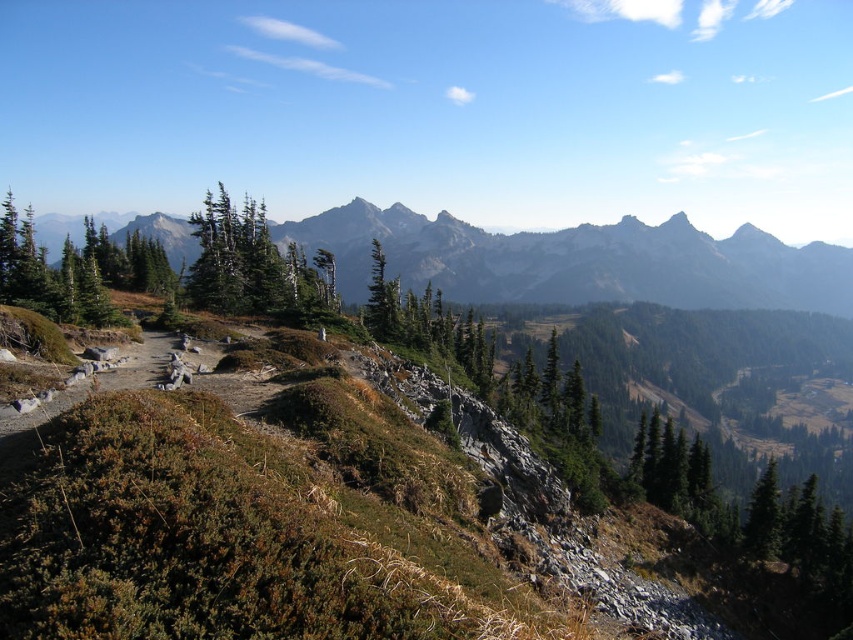
Question: Where is gray rocky mountains at center located in relation to green matte tree at center in the image?

Choices:
 (A) left
 (B) right

Answer: (B)

Question: Considering the real-world distances, which object is farthest from the green matte tree at upper left?

Choices:
 (A) gray rocky mountains at center
 (B) green matte tree at center

Answer: (A)

Question: Which of these objects is positioned farthest from the green matte tree at center?

Choices:
 (A) green matte tree at upper left
 (B) gray rocky mountains at center

Answer: (B)

Question: Is green matte tree at upper left above green matte tree at center?

Choices:
 (A) no
 (B) yes

Answer: (A)

Question: Which point is closer to the camera taking this photo?

Choices:
 (A) (370, 266)
 (B) (222, 211)

Answer: (B)

Question: Is gray rocky mountains at center positioned before green matte tree at upper left?

Choices:
 (A) no
 (B) yes

Answer: (A)